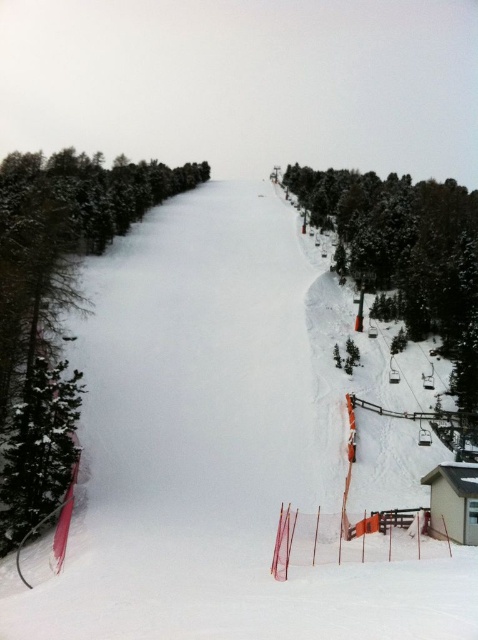
Who is higher up, white snow ski slope at center or green matte tree at lower left?

white snow ski slope at center is higher up.

At what (x,y) coordinates should I click in order to perform the action: click on white snow ski slope at center. Please return your answer as a coordinate pair (x, y). This screenshot has width=478, height=640. Looking at the image, I should click on (218, 445).

This screenshot has height=640, width=478. In order to click on white snow ski slope at center in this screenshot , I will do `click(218, 445)`.

Measure the distance between white snow ski slope at center and green textured tree at right.

white snow ski slope at center and green textured tree at right are 40.45 meters apart.

Which is below, white snow ski slope at center or green textured tree at right?

white snow ski slope at center

The height and width of the screenshot is (640, 478). Describe the element at coordinates (218, 445) in the screenshot. I see `white snow ski slope at center` at that location.

The width and height of the screenshot is (478, 640). Find the location of `white snow ski slope at center`. white snow ski slope at center is located at coordinates (218, 445).

Does green matte tree at left come in front of green matte tree at lower left?

No, green matte tree at left is behind green matte tree at lower left.

At what (x,y) coordinates should I click in order to perform the action: click on green matte tree at left. Please return your answer as a coordinate pair (x, y). Looking at the image, I should click on (55, 298).